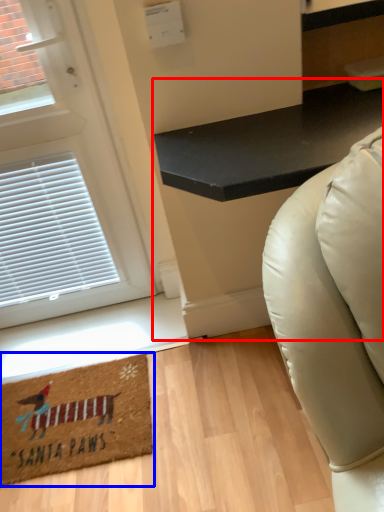
Question: Which object appears closest to the camera in this image, table (highlighted by a red box) or mat (highlighted by a blue box)?

Choices:
 (A) table
 (B) mat

Answer: (A)